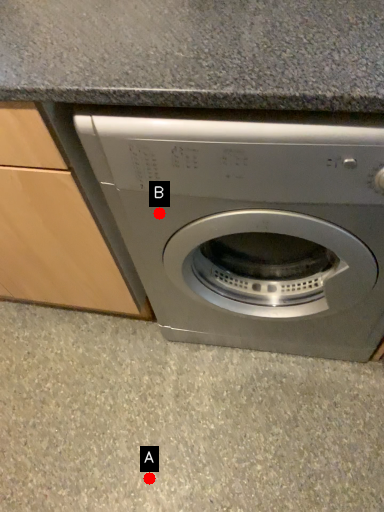
Question: Two points are circled on the image, labeled by A and B beside each circle. Which point is further to the camera?

Choices:
 (A) A is further
 (B) B is further

Answer: (A)